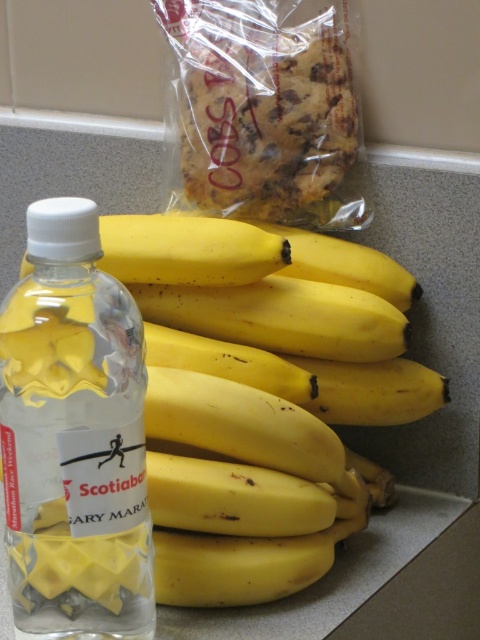
Does yellow matte bananas at center have a larger size compared to golden brown cookie at upper center?

Yes, yellow matte bananas at center is bigger than golden brown cookie at upper center.

Which is below, yellow matte bananas at center or golden brown cookie at upper center?

yellow matte bananas at center is below.

Is point (243, 362) positioned before point (231, 42)?

Yes, it is in front of point (231, 42).

This screenshot has height=640, width=480. In order to click on yellow matte bananas at center in this screenshot , I will do `click(259, 404)`.

Which is more to the left, clear plastic bottle at left or golden brown cookie at upper center?

clear plastic bottle at left is more to the left.

Who is shorter, clear plastic bottle at left or golden brown cookie at upper center?

With less height is golden brown cookie at upper center.

Who is more distant from viewer, (x=142, y=508) or (x=310, y=173)?

Point (x=310, y=173)

Locate an element on the screen. clear plastic bottle at left is located at coordinates 73,436.

Locate an element on the screen. yellow matte bananas at center is located at coordinates (259, 404).

Who is more forward, (x=151, y=353) or (x=28, y=556)?

Point (x=28, y=556) is more forward.

Which is in front, point (182, 600) or point (31, 564)?

Point (31, 564)

I want to click on yellow matte bananas at center, so click(x=259, y=404).